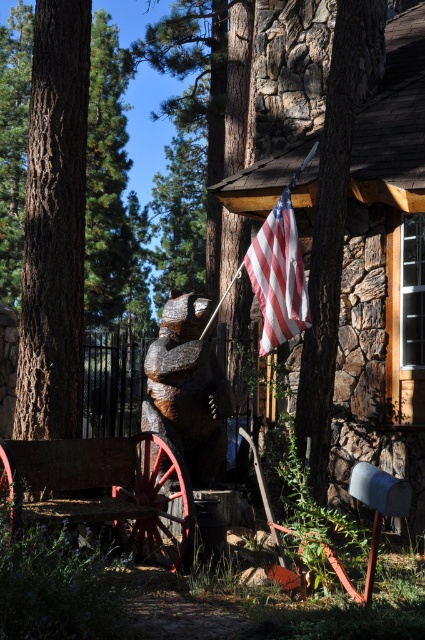
You are standing in front of the cabin and want to place a new flower pot on the ground. The flower pot must be placed between the rustic wood wagon at center and the american flag at upper center. Is this possible?

The rustic wood wagon at center is in front of the american flag at upper center, so there is space between them for placing the flower pot.

You are a visitor standing in front of the wooden cabin. You see the wooden bear at center and the american flag at upper center. Which object is closer to you?

The wooden bear at center is closer to you because it is positioned under the american flag at upper center, indicating it is lower in the scene.

You are a delivery person holding a package that needs to be placed exactly halfway between the stone cabin at upper right and the wooden bear at center. Where should you place the package?

The package should be placed exactly halfway between the stone cabin at upper right and the wooden bear at center, which is 7.635 feet from each object.